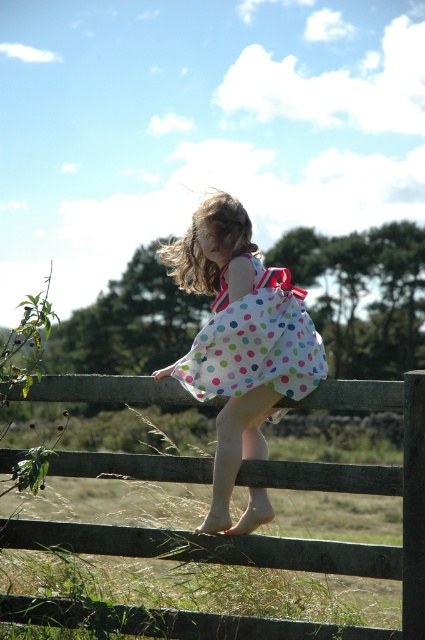
Question: Which object appears closest to the camera in this image?

Choices:
 (A) white polka dot dress at center
 (B) wooden fence at center
 (C) polka dot fabric dress at center

Answer: (B)

Question: Which point is farther from the camera taking this photo?

Choices:
 (A) (411, 486)
 (B) (285, 337)

Answer: (B)

Question: Does white polka dot dress at center come behind polka dot fabric dress at center?

Choices:
 (A) yes
 (B) no

Answer: (A)

Question: Can you confirm if wooden fence at center is wider than white polka dot dress at center?

Choices:
 (A) no
 (B) yes

Answer: (B)

Question: Can you confirm if wooden fence at center is bigger than polka dot fabric dress at center?

Choices:
 (A) no
 (B) yes

Answer: (B)

Question: Which point is farther to the camera?

Choices:
 (A) wooden fence at center
 (B) white polka dot dress at center

Answer: (B)